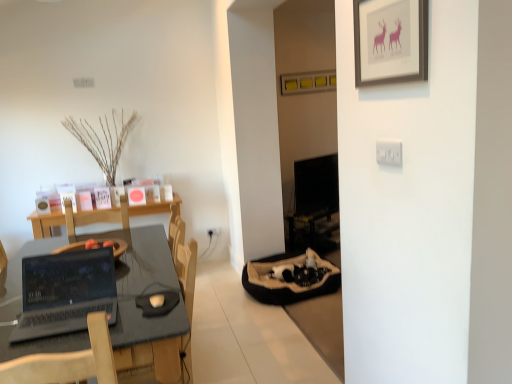
Question: Does silver metallic laptop at lower left have a greater width compared to matte black desk at left?

Choices:
 (A) yes
 (B) no

Answer: (B)

Question: Is silver metallic laptop at lower left aimed at matte black desk at left?

Choices:
 (A) no
 (B) yes

Answer: (A)

Question: Is silver metallic laptop at lower left behind matte black desk at left?

Choices:
 (A) no
 (B) yes

Answer: (B)

Question: Is silver metallic laptop at lower left taller than matte black desk at left?

Choices:
 (A) yes
 (B) no

Answer: (B)

Question: Can matte black desk at left be found inside silver metallic laptop at lower left?

Choices:
 (A) yes
 (B) no

Answer: (B)

Question: Is silver metallic laptop at lower left directly adjacent to matte black desk at left?

Choices:
 (A) yes
 (B) no

Answer: (B)

Question: Could you tell me if white plastic light switch at upper right is facing brown suede pet bed at lower right?

Choices:
 (A) no
 (B) yes

Answer: (A)

Question: From a real-world perspective, is white plastic light switch at upper right under brown suede pet bed at lower right?

Choices:
 (A) yes
 (B) no

Answer: (B)

Question: Considering the relative positions of white plastic light switch at upper right and brown suede pet bed at lower right in the image provided, is white plastic light switch at upper right in front of brown suede pet bed at lower right?

Choices:
 (A) no
 (B) yes

Answer: (B)

Question: Considering the relative sizes of white plastic light switch at upper right and brown suede pet bed at lower right in the image provided, is white plastic light switch at upper right wider than brown suede pet bed at lower right?

Choices:
 (A) yes
 (B) no

Answer: (B)

Question: Is brown suede pet bed at lower right a part of white plastic light switch at upper right?

Choices:
 (A) no
 (B) yes

Answer: (A)

Question: Does white plastic light switch at upper right come behind brown suede pet bed at lower right?

Choices:
 (A) yes
 (B) no

Answer: (B)

Question: Are silver metallic laptop at lower left and black glossy monitor at center located far from each other?

Choices:
 (A) yes
 (B) no

Answer: (A)